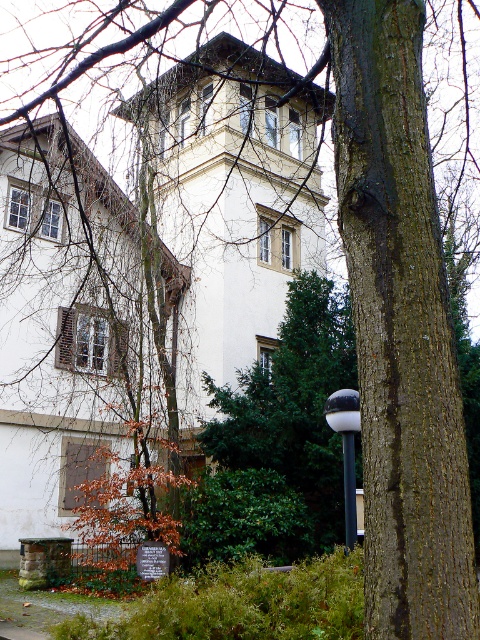
You are standing in front of the building and notice two poles. The white glossy lamp post at center right and the black metal pole at center. Which pole is taller?

The white glossy lamp post at center right is much taller than the black metal pole at center.